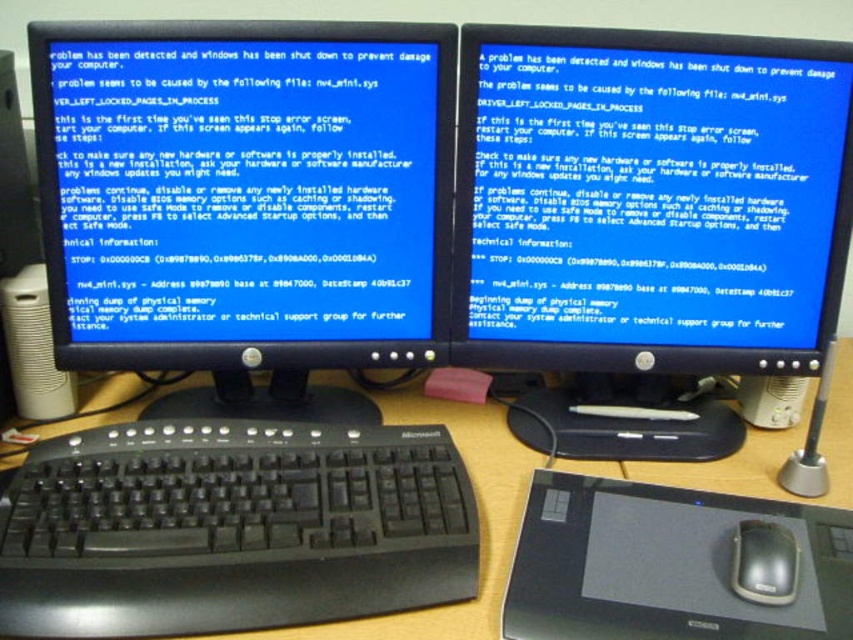
Question: Where is black plastic monitor at center located in relation to wooden desk at center in the image?

Choices:
 (A) below
 (B) above

Answer: (B)

Question: Which is farther from the black matte mouse at lower right?

Choices:
 (A) black plastic keyboard at lower left
 (B) black plastic monitor at center
 (C) black glossy monitor at center
 (D) wooden desk at center

Answer: (C)

Question: Among these objects, which one is nearest to the camera?

Choices:
 (A) black plastic keyboard at lower left
 (B) black matte mouse at lower right

Answer: (A)

Question: Can you confirm if black plastic keyboard at lower left is smaller than black matte mouse at lower right?

Choices:
 (A) yes
 (B) no

Answer: (B)

Question: Is black plastic monitor at center bigger than black plastic keyboard at lower left?

Choices:
 (A) yes
 (B) no

Answer: (A)

Question: Which object is the farthest from the wooden desk at center?

Choices:
 (A) black plastic monitor at center
 (B) black matte mouse at lower right
 (C) black glossy monitor at center
 (D) black plastic keyboard at lower left

Answer: (C)